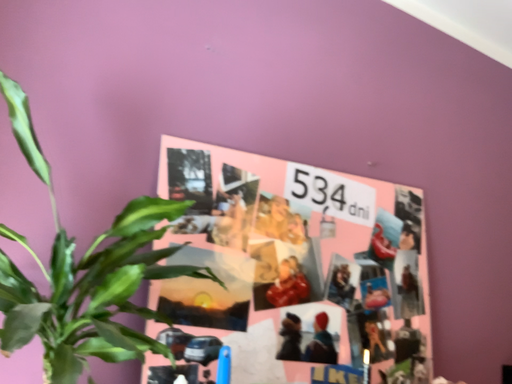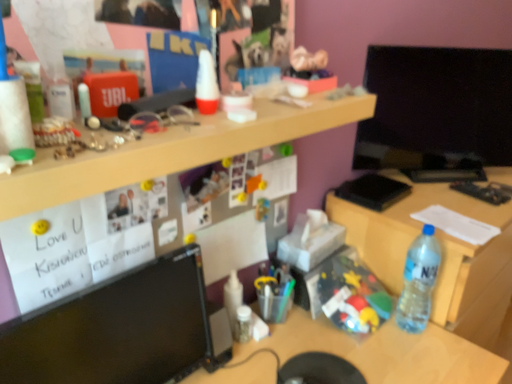
Question: Which way did the camera rotate in the video?

Choices:
 (A) rotated downward
 (B) rotated upward

Answer: (A)